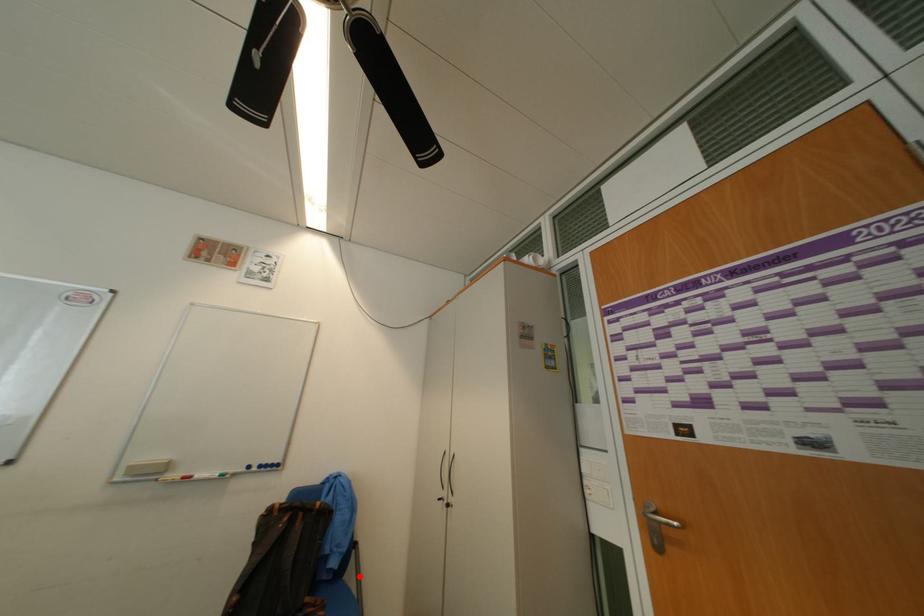
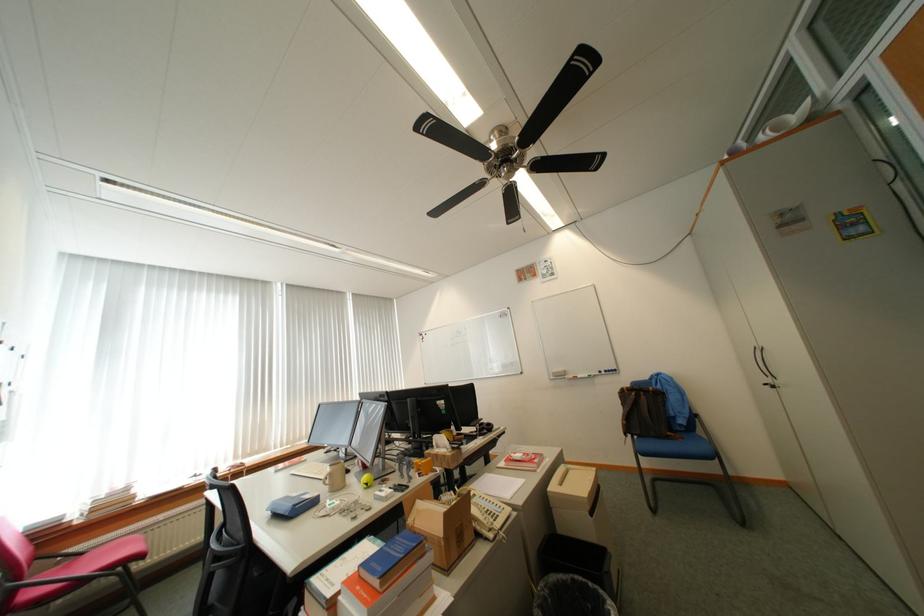
Find the pixel in the second image that matches the highlighted location in the first image.

(709, 432)